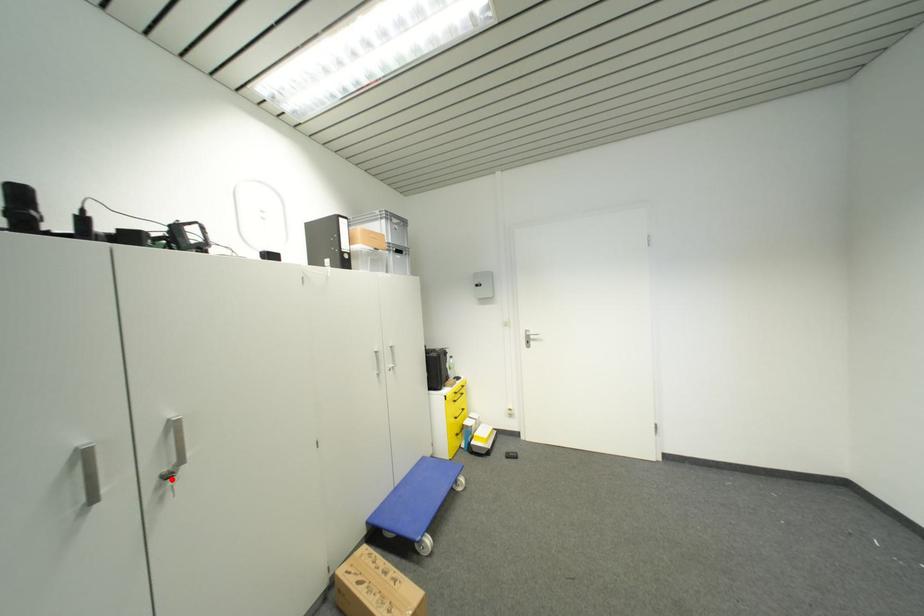
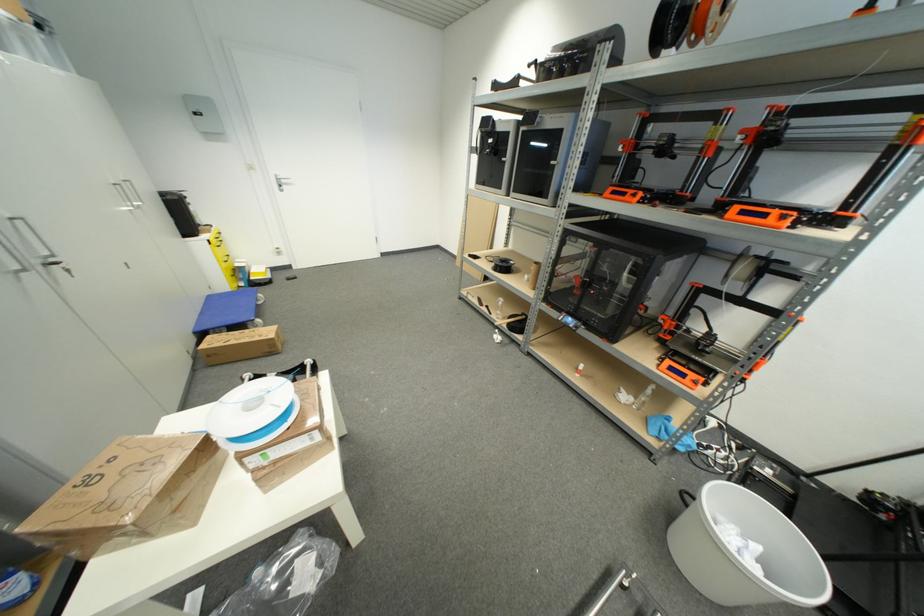
Question: I am providing you with two images of the same scene from different viewpoints. In image1, a red point is highlighted. Considering the same 3D point in image2, which of the following is correct?

Choices:
 (A) It is closer
 (B) It is farther

Answer: (B)